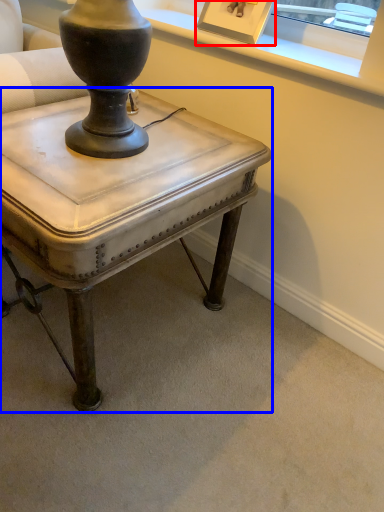
Question: Which of the following is the farthest to the observer, picture frame (highlighted by a red box) or table (highlighted by a blue box)?

Choices:
 (A) picture frame
 (B) table

Answer: (A)